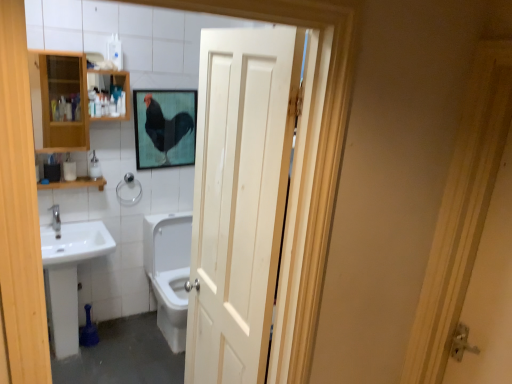
Question: From the image's perspective, is white matte toilet paper at left on top of silver metallic towel bar at center left?

Choices:
 (A) yes
 (B) no

Answer: (A)

Question: Is white matte toilet paper at left far from silver metallic towel bar at center left?

Choices:
 (A) no
 (B) yes

Answer: (A)

Question: From a real-world perspective, does white matte toilet paper at left stand above silver metallic towel bar at center left?

Choices:
 (A) yes
 (B) no

Answer: (A)

Question: Could you tell me if white matte toilet paper at left is facing silver metallic towel bar at center left?

Choices:
 (A) no
 (B) yes

Answer: (A)

Question: From a real-world perspective, is white matte toilet paper at left positioned under silver metallic towel bar at center left based on gravity?

Choices:
 (A) no
 (B) yes

Answer: (A)

Question: In terms of width, does wooden shelf at left look wider or thinner when compared to wooden cabinet at left?

Choices:
 (A) wide
 (B) thin

Answer: (B)

Question: Which is correct: wooden shelf at left is inside wooden cabinet at left, or outside of it?

Choices:
 (A) outside
 (B) inside

Answer: (A)

Question: Looking at the image, does wooden shelf at left seem bigger or smaller compared to wooden cabinet at left?

Choices:
 (A) big
 (B) small

Answer: (B)

Question: Considering their positions, is wooden shelf at left located in front of or behind wooden cabinet at left?

Choices:
 (A) front
 (B) behind

Answer: (B)

Question: Is point (203, 132) closer or farther from the camera than point (39, 62)?

Choices:
 (A) farther
 (B) closer

Answer: (B)

Question: Considering their positions, is white wood door at center located in front of or behind wooden cabinet at left?

Choices:
 (A) front
 (B) behind

Answer: (A)

Question: Looking at their shapes, would you say white wood door at center is wider or thinner than wooden cabinet at left?

Choices:
 (A) wide
 (B) thin

Answer: (B)

Question: Considering the positions of white wood door at center and wooden cabinet at left in the image, is white wood door at center bigger or smaller than wooden cabinet at left?

Choices:
 (A) big
 (B) small

Answer: (A)

Question: From a real-world perspective, is matte black rooster at upper center positioned above or below silver metallic towel bar at center left?

Choices:
 (A) below
 (B) above

Answer: (B)

Question: Looking at their shapes, would you say matte black rooster at upper center is wider or thinner than silver metallic towel bar at center left?

Choices:
 (A) wide
 (B) thin

Answer: (B)